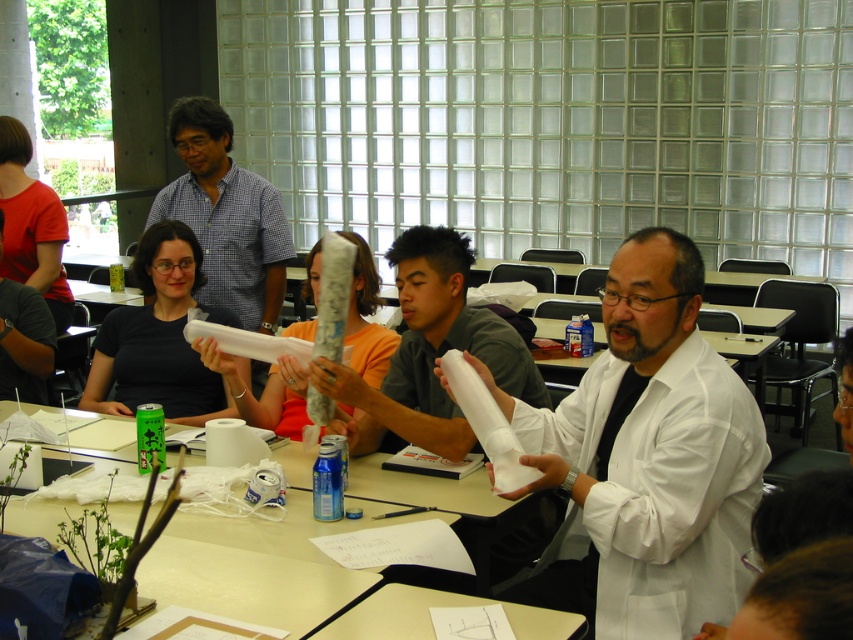
Question: Which object is the closest to the matte gray paper towel at center?

Choices:
 (A) white matte lab coat at center
 (B) white paper at center

Answer: (A)

Question: Which point is farther to the camera?

Choices:
 (A) white paper at center
 (B) matte gray paper towel at center

Answer: (B)

Question: Can you confirm if white matte lab coat at center is wider than white paper at center?

Choices:
 (A) no
 (B) yes

Answer: (B)

Question: In this image, where is white matte lab coat at center located relative to matte gray paper towel at center?

Choices:
 (A) below
 (B) above

Answer: (A)

Question: Which is farther from the white matte lab coat at center?

Choices:
 (A) matte gray paper towel at center
 (B) white paper at center

Answer: (A)

Question: Does white matte lab coat at center appear over white paper at center?

Choices:
 (A) no
 (B) yes

Answer: (B)